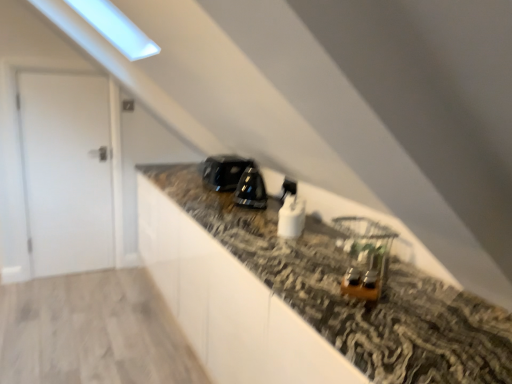
Question: Looking at the image, does glossy black toaster at center, acting as the fifth appliance starting from the right, seem bigger or smaller compared to white glossy plug at center, which is the third appliance in right-to-left order?

Choices:
 (A) big
 (B) small

Answer: (A)

Question: Considering the positions of glossy black toaster at center, placed as the fifth appliance when sorted from front to back, and white glossy plug at center, the third appliance viewed from the left, in the image, is glossy black toaster at center, placed as the fifth appliance when sorted from front to back, taller or shorter than white glossy plug at center, the third appliance viewed from the left,?

Choices:
 (A) tall
 (B) short

Answer: (A)

Question: Based on their relative distances, which object is nearer to the white glossy plug at center, marked as the second appliance in a front-to-back arrangement?

Choices:
 (A) glossy black toaster at center, acting as the fifth appliance starting from the right
 (B) white matte door at left
 (C) white glossy plug at center, which is counted as the fourth appliance, starting from the front
 (D) wooden earrings at center, the first appliance viewed from the right
 (E) black glossy kettle at center, marked as the third appliance in a front-to-back arrangement

Answer: (C)

Question: Based on their relative distances, which object is nearer to the black glossy kettle at center, marked as the third appliance in a front-to-back arrangement?

Choices:
 (A) white matte door at left
 (B) white glossy plug at center, the third appliance viewed from the left
 (C) glossy black toaster at center, placed as the fifth appliance when sorted from front to back
 (D) white glossy plug at center, the second appliance positioned from the back
 (E) wooden earrings at center, acting as the fifth appliance starting from the left

Answer: (C)